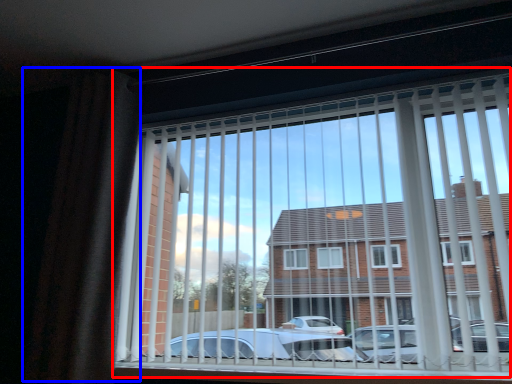
Question: Which object is further to the camera taking this photo, window (highlighted by a red box) or curtain (highlighted by a blue box)?

Choices:
 (A) window
 (B) curtain

Answer: (B)